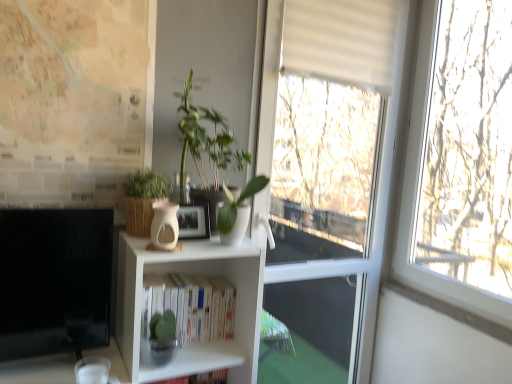
Question: Considering the relative sizes of brown woven basket at center, placed as the 1th houseplant when sorted from left to right, and white matte bookshelf at center in the image provided, is brown woven basket at center, placed as the 1th houseplant when sorted from left to right, thinner than white matte bookshelf at center?

Choices:
 (A) no
 (B) yes

Answer: (A)

Question: Is brown woven basket at center, placed as the 1th houseplant when sorted from left to right, taller than white matte bookshelf at center?

Choices:
 (A) yes
 (B) no

Answer: (B)

Question: From a real-world perspective, is brown woven basket at center, marked as the 2th houseplant in a right-to-left arrangement, over white matte bookshelf at center?

Choices:
 (A) no
 (B) yes

Answer: (B)

Question: Considering the relative positions of brown woven basket at center, marked as the 2th houseplant in a right-to-left arrangement, and white matte bookshelf at center in the image provided, is brown woven basket at center, marked as the 2th houseplant in a right-to-left arrangement, behind white matte bookshelf at center?

Choices:
 (A) no
 (B) yes

Answer: (A)

Question: From the image's perspective, does brown woven basket at center, marked as the 2th houseplant in a right-to-left arrangement, appear lower than white matte bookshelf at center?

Choices:
 (A) no
 (B) yes

Answer: (A)

Question: From a real-world perspective, is map paper at left positioned above or below white matte window at center?

Choices:
 (A) above
 (B) below

Answer: (A)

Question: Looking at the image, does map paper at left seem bigger or smaller compared to white matte window at center?

Choices:
 (A) big
 (B) small

Answer: (B)

Question: In terms of width, does map paper at left look wider or thinner when compared to white matte window at center?

Choices:
 (A) wide
 (B) thin

Answer: (B)

Question: Would you say map paper at left is to the left or to the right of white matte window at center in the picture?

Choices:
 (A) right
 (B) left

Answer: (B)

Question: Considering the relative positions of matte beige vase at center and white glossy vase at center, which is the first plant from right to left, in the image provided, is matte beige vase at center to the left or to the right of white glossy vase at center, which is the first plant from right to left,?

Choices:
 (A) right
 (B) left

Answer: (B)

Question: From the image's perspective, is matte beige vase at center positioned above or below white glossy vase at center, which is the first plant from right to left?

Choices:
 (A) above
 (B) below

Answer: (B)

Question: Is matte beige vase at center taller or shorter than white glossy vase at center, which is the second plant in left-to-right order?

Choices:
 (A) short
 (B) tall

Answer: (A)

Question: Is matte beige vase at center spatially inside white glossy vase at center, which is the first plant from right to left, or outside of it?

Choices:
 (A) inside
 (B) outside

Answer: (B)

Question: From a real-world perspective, relative to green leafy plant at center, arranged as the second plant when viewed from the right, is white matte bookshelf at center vertically above or below?

Choices:
 (A) above
 (B) below

Answer: (B)

Question: Considering the positions of white matte bookshelf at center and green leafy plant at center, which is the first plant from left to right, in the image, is white matte bookshelf at center wider or thinner than green leafy plant at center, which is the first plant from left to right,?

Choices:
 (A) wide
 (B) thin

Answer: (B)